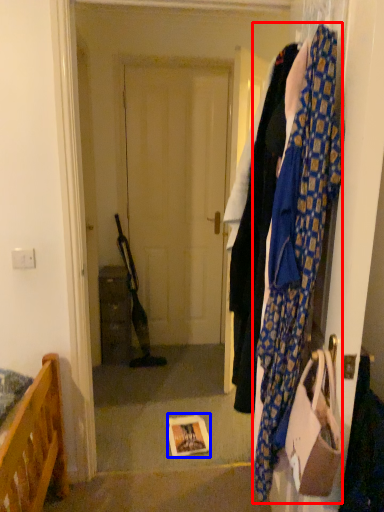
Question: Which object appears farthest to the camera in this image, scarf (highlighted by a red box) or book (highlighted by a blue box)?

Choices:
 (A) scarf
 (B) book

Answer: (B)